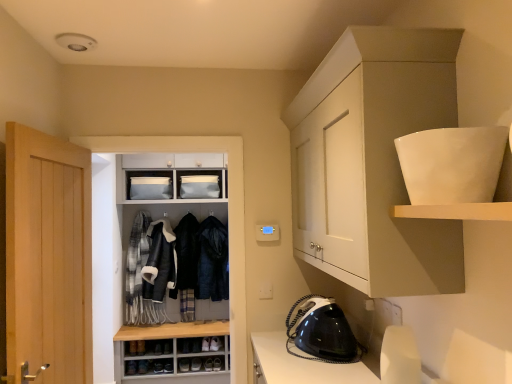
Question: From the image's perspective, is white matte shelf at upper right, the 1th shelf ordered from the bottom, under light wood door at left?

Choices:
 (A) yes
 (B) no

Answer: (B)

Question: From the image's perspective, is white matte shelf at upper right, the 1th shelf ordered from the bottom, above light wood door at left?

Choices:
 (A) yes
 (B) no

Answer: (A)

Question: Is white matte shelf at upper right, positioned as the second shelf in top-to-bottom order, closer to camera compared to light wood door at left?

Choices:
 (A) yes
 (B) no

Answer: (A)

Question: Is white matte shelf at upper right, the 1th shelf ordered from the bottom, placed right next to light wood door at left?

Choices:
 (A) yes
 (B) no

Answer: (B)

Question: From a real-world perspective, is white matte shelf at upper right, the 1th shelf ordered from the bottom, physically below light wood door at left?

Choices:
 (A) yes
 (B) no

Answer: (B)

Question: Is white matte shelf at upper right, positioned as the second shelf in top-to-bottom order, in front of or behind white glossy bowl at upper right, which is counted as the 1th shelf, starting from the top, in the image?

Choices:
 (A) front
 (B) behind

Answer: (A)

Question: Based on their sizes in the image, would you say white matte shelf at upper right, positioned as the second shelf in top-to-bottom order, is bigger or smaller than white glossy bowl at upper right, marked as the 2th shelf in a bottom-to-top arrangement?

Choices:
 (A) big
 (B) small

Answer: (B)

Question: Is white matte shelf at upper right, positioned as the second shelf in top-to-bottom order, taller or shorter than white glossy bowl at upper right, which is counted as the 1th shelf, starting from the top?

Choices:
 (A) short
 (B) tall

Answer: (A)

Question: Is point (397, 208) positioned closer to the camera than point (450, 193)?

Choices:
 (A) closer
 (B) farther

Answer: (B)

Question: From the image's perspective, relative to leather shoes at center, is white matte shelf at upper right, positioned as the second shelf in top-to-bottom order, above or below?

Choices:
 (A) below
 (B) above

Answer: (B)

Question: Is white matte shelf at upper right, the 1th shelf ordered from the bottom, wider or thinner than leather shoes at center?

Choices:
 (A) wide
 (B) thin

Answer: (A)

Question: From a real-world perspective, is white matte shelf at upper right, the 1th shelf ordered from the bottom, positioned above or below leather shoes at center?

Choices:
 (A) below
 (B) above

Answer: (B)

Question: In the image, is white matte shelf at upper right, the 1th shelf ordered from the bottom, positioned in front of or behind leather shoes at center?

Choices:
 (A) behind
 (B) front

Answer: (B)

Question: Is leather jacket at center, placed as the 2th clothing when sorted from left to right, wider or thinner than plaid wool scarf at center left, which is the fourth clothing in right-to-left order?

Choices:
 (A) wide
 (B) thin

Answer: (A)

Question: Based on their positions, is leather jacket at center, placed as the 2th clothing when sorted from left to right, located to the left or right of plaid wool scarf at center left, which is the fourth clothing in right-to-left order?

Choices:
 (A) left
 (B) right

Answer: (B)